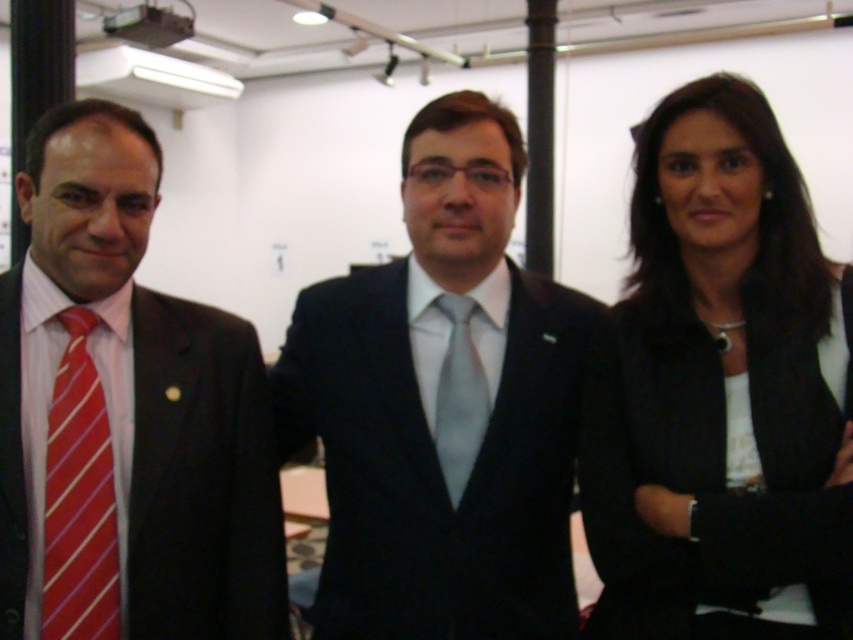
Between matte black suit at center and matte black suit at left, which one is positioned higher?

matte black suit at center is above.

Is point (334, 374) farther from viewer compared to point (16, 420)?

That is True.

Is point (448, 608) closer to viewer compared to point (32, 476)?

No.

Find the location of a particular element. matte black suit at center is located at coordinates (442, 406).

Who is positioned more to the right, red striped tie at left or light gray silk tie at center?

light gray silk tie at center

Who is more distant from viewer, (100, 397) or (466, 301)?

Point (466, 301)

Between point (79, 323) and point (439, 445), which one is positioned behind?

The point (439, 445) is behind.

Locate an element on the screen. The width and height of the screenshot is (853, 640). red striped tie at left is located at coordinates (79, 499).

Can you confirm if matte black suit at center is shorter than light gray silk tie at center?

No, matte black suit at center is not shorter than light gray silk tie at center.

Which is behind, point (454, 285) or point (444, 384)?

Positioned behind is point (454, 285).

Image resolution: width=853 pixels, height=640 pixels. What are the coordinates of `matte black suit at center` in the screenshot? It's located at (442, 406).